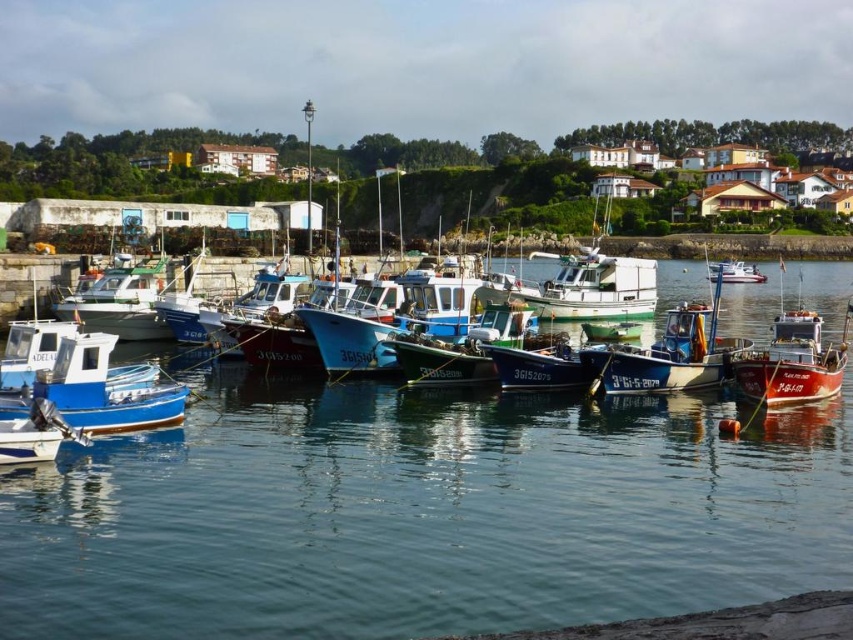
I want to click on clear water at center, so click(422, 515).

Locate an element on the screen. clear water at center is located at coordinates [x=422, y=515].

This screenshot has height=640, width=853. I want to click on clear water at center, so click(x=422, y=515).